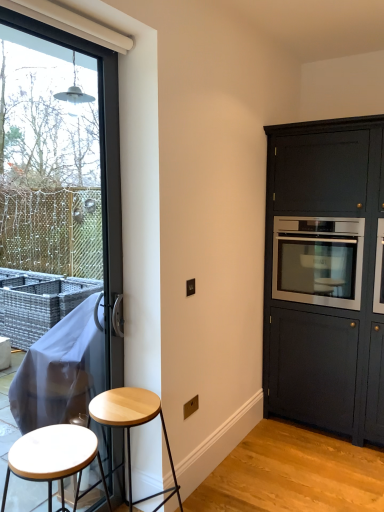
Question: Considering the positions of transparent glass window at left and stainless steel oven at right in the image, is transparent glass window at left taller or shorter than stainless steel oven at right?

Choices:
 (A) short
 (B) tall

Answer: (B)

Question: From a real-world perspective, relative to stainless steel oven at right, is transparent glass window at left vertically above or below?

Choices:
 (A) above
 (B) below

Answer: (A)

Question: Which of these objects is positioned closest to the white matte stool at lower left, arranged as the 2th stool when viewed from the back?

Choices:
 (A) transparent glass window at left
 (B) matte dark wood cabinet at right
 (C) stainless steel oven at right
 (D) light wood stool at lower left, which is counted as the 2th stool, starting from the front

Answer: (D)

Question: Which object is positioned farthest from the transparent glass window at left?

Choices:
 (A) stainless steel oven at right
 (B) white matte stool at lower left, which appears as the first stool when viewed from the front
 (C) matte dark wood cabinet at right
 (D) light wood stool at lower left, the first stool in the back-to-front sequence

Answer: (C)